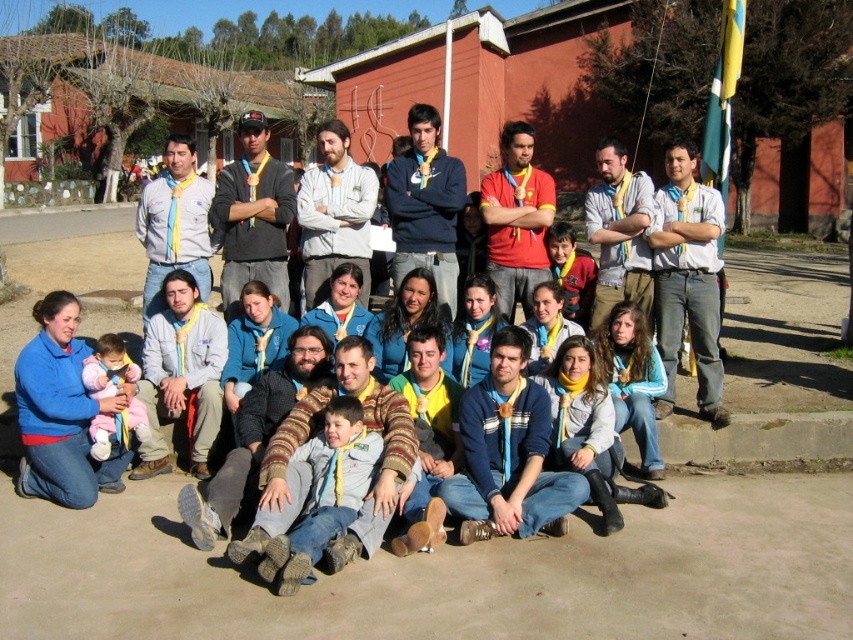
Is light blue shirt at center smaller than white fleece jacket at center?

Incorrect, light blue shirt at center is not smaller in size than white fleece jacket at center.

Which is in front, point (718, 294) or point (328, 260)?

Point (718, 294) is more forward.

Describe the element at coordinates (688, 278) in the screenshot. The width and height of the screenshot is (853, 640). I see `light blue shirt at center` at that location.

Identify the location of light blue shirt at center. This screenshot has height=640, width=853. (688, 278).

From the picture: Does white fleece jacket at center have a lesser width compared to matte red shirt at center?

Yes.

Does white fleece jacket at center appear on the left side of matte red shirt at center?

Indeed, white fleece jacket at center is positioned on the left side of matte red shirt at center.

Image resolution: width=853 pixels, height=640 pixels. What are the coordinates of `white fleece jacket at center` in the screenshot? It's located at (334, 214).

Is the position of light blue shirt at center more distant than that of matte white shirt at center?

That is False.

Is point (721, 372) positioned behind point (643, 257)?

No, (721, 372) is closer to viewer.

Locate an element on the screen. This screenshot has width=853, height=640. light blue shirt at center is located at coordinates (688, 278).